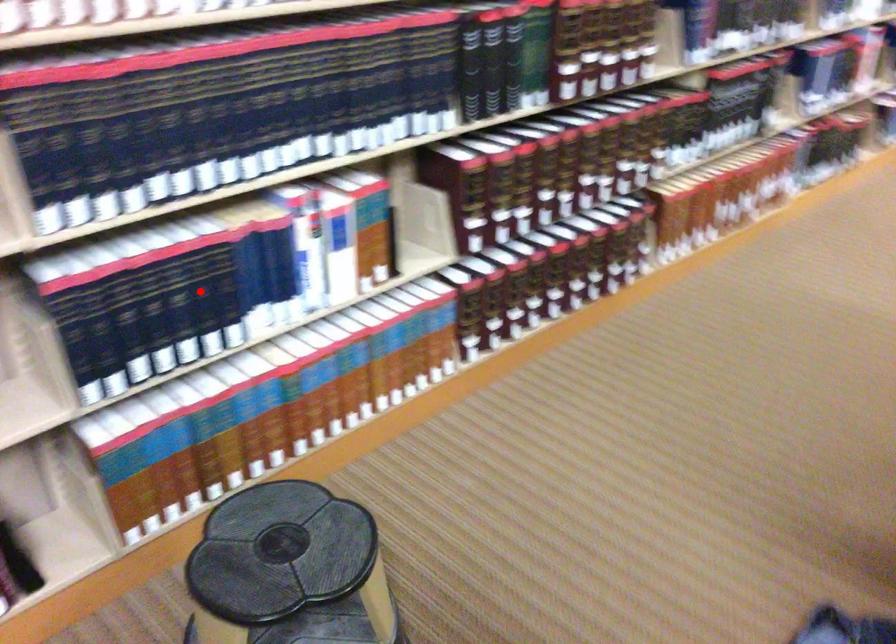
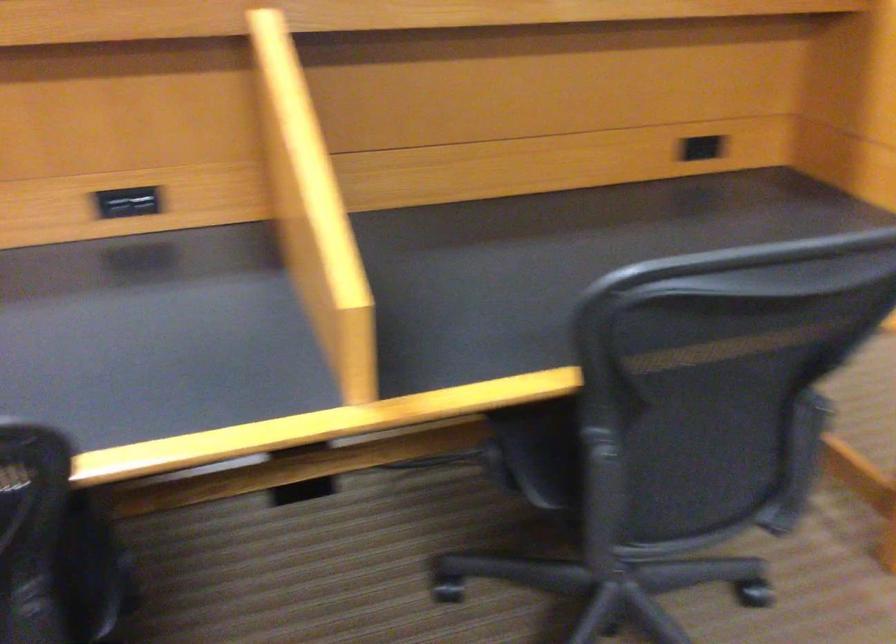
Question: I am providing you with two images of the same scene from different viewpoints. A red point is marked on the first image. Is the red point's position out of view in image 2?

Choices:
 (A) Yes
 (B) No

Answer: (A)